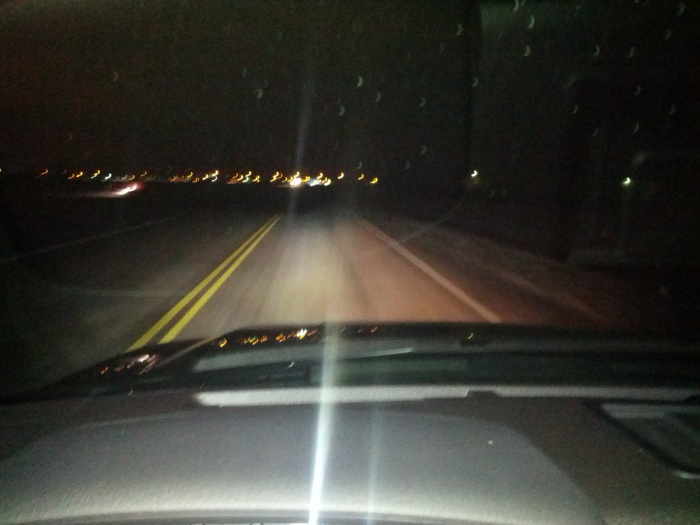
Identify the location of lights in the background. (297, 178), (342, 183), (141, 171), (244, 173), (472, 170).